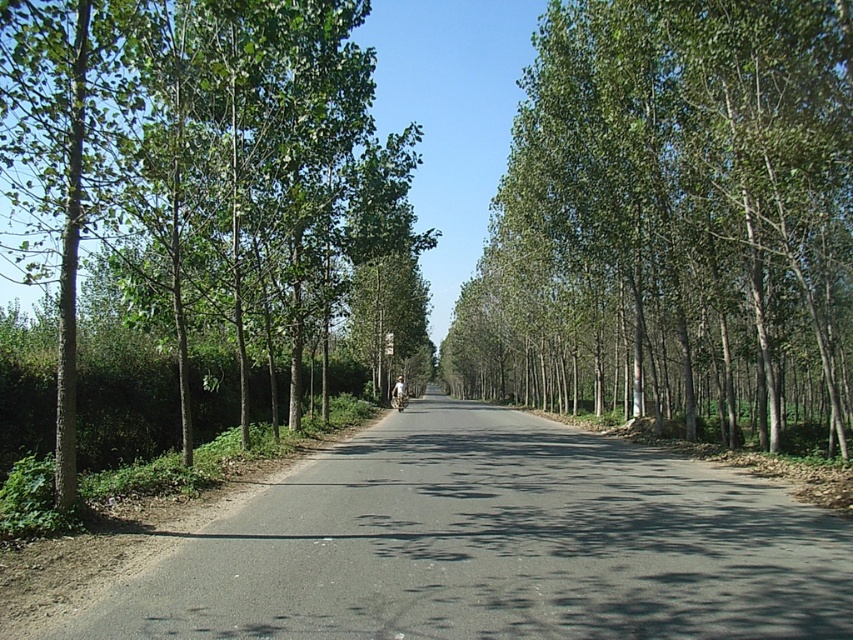
Can you confirm if green leafy tree at center is positioned above green leafy tree at left?

No, green leafy tree at center is not above green leafy tree at left.

Which is more to the left, green leafy tree at center or green leafy tree at left?

From the viewer's perspective, green leafy tree at left appears more on the left side.

Is point (651, 67) positioned behind point (74, 442)?

Yes.

Where is `green leafy tree at center`? The width and height of the screenshot is (853, 640). green leafy tree at center is located at coordinates (674, 216).